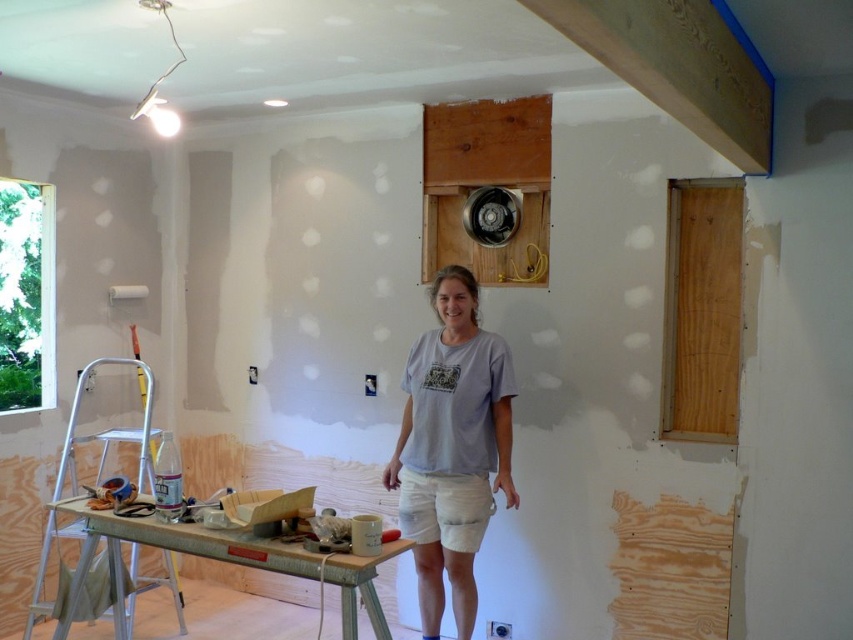
Question: Which point is farther to the camera?

Choices:
 (A) (751, 172)
 (B) (482, 342)
 (C) (36, 582)

Answer: (C)

Question: Is gray cotton t-shirt at center below silver metallic ladder at lower left?

Choices:
 (A) no
 (B) yes

Answer: (A)

Question: Which of the following is the farthest from the observer?

Choices:
 (A) gray cotton t-shirt at center
 (B) green painted wood beam at upper center
 (C) silver metallic ladder at lower left

Answer: (C)

Question: Does green painted wood beam at upper center have a larger size compared to silver metallic ladder at lower left?

Choices:
 (A) yes
 (B) no

Answer: (B)

Question: Among these objects, which one is farthest from the camera?

Choices:
 (A) green painted wood beam at upper center
 (B) silver metallic ladder at lower left
 (C) gray cotton t-shirt at center

Answer: (B)

Question: Does gray cotton t-shirt at center have a larger size compared to silver metallic ladder at lower left?

Choices:
 (A) no
 (B) yes

Answer: (A)